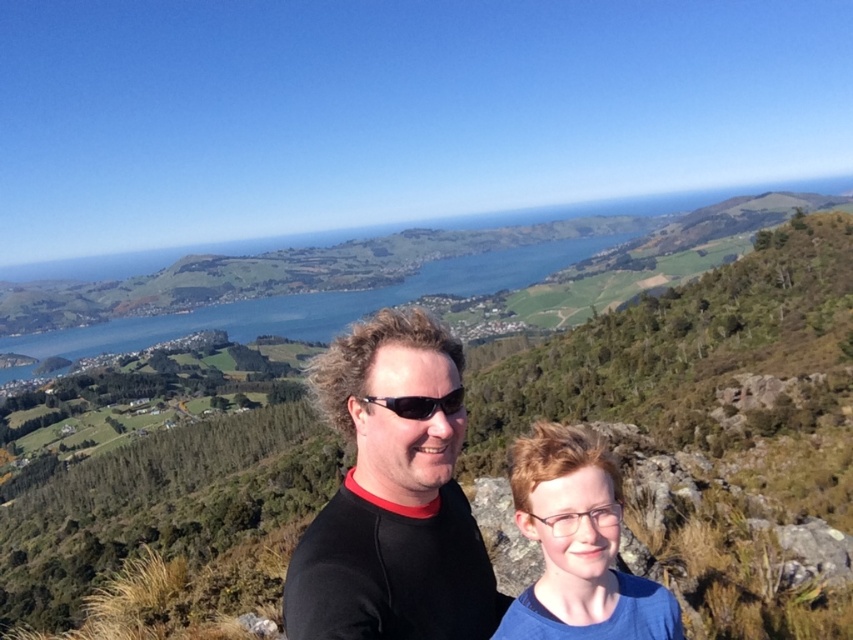
Question: Which point appears farthest from the camera in this image?

Choices:
 (A) (387, 554)
 (B) (599, 595)
 (C) (370, 397)

Answer: (C)

Question: Which point is closer to the camera?

Choices:
 (A) (660, 584)
 (B) (442, 397)

Answer: (B)

Question: Which point is closer to the camera?

Choices:
 (A) matte black shirt at center
 (B) black plastic sunglasses at center
 (C) black matte shirt at center

Answer: (C)

Question: Can you confirm if matte black shirt at center is wider than black plastic sunglasses at center?

Choices:
 (A) yes
 (B) no

Answer: (A)

Question: Does black matte shirt at center have a larger size compared to black plastic sunglasses at center?

Choices:
 (A) no
 (B) yes

Answer: (B)

Question: Where is black matte shirt at center located in relation to black plastic sunglasses at center in the image?

Choices:
 (A) below
 (B) above

Answer: (A)